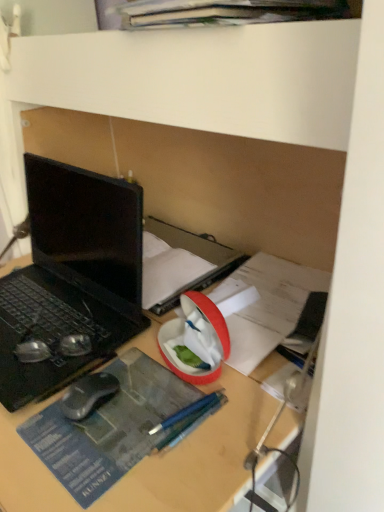
Question: Would you say black rubberized mouse at lower left is to the left or to the right of metallic blue pencil at center in the picture?

Choices:
 (A) right
 (B) left

Answer: (B)

Question: Considering the positions of black rubberized mouse at lower left and metallic blue pencil at center in the image, is black rubberized mouse at lower left taller or shorter than metallic blue pencil at center?

Choices:
 (A) short
 (B) tall

Answer: (B)

Question: Which object is positioned farthest from the metallic blue pencil at center?

Choices:
 (A) matte black book at center
 (B) black matte laptop at left
 (C) black rubberized mouse at lower left

Answer: (A)

Question: Estimate the real-world distances between objects in this image. Which object is farther from the black rubberized mouse at lower left?

Choices:
 (A) black matte laptop at left
 (B) metallic blue pencil at center
 (C) matte black book at center

Answer: (C)